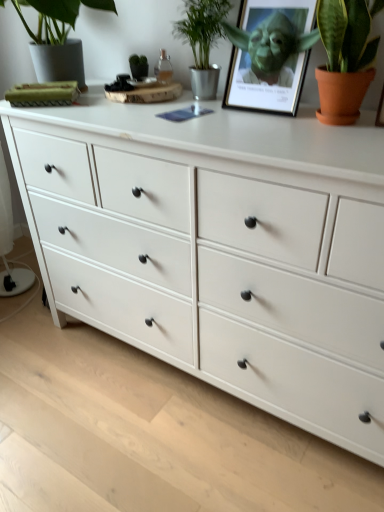
Find the location of a particular element. vacant area that lies between terracotta clay pot at upper right, the third houseplant in the left-to-right sequence, and matte green picture frame at upper center is located at coordinates [x=259, y=115].